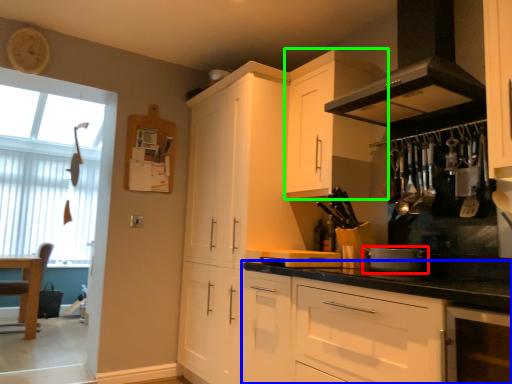
Question: Considering the real-world distances, which object is closest to appliance (highlighted by a red box)? cabinetry (highlighted by a blue box) or cabinetry (highlighted by a green box).

Choices:
 (A) cabinetry
 (B) cabinetry

Answer: (A)